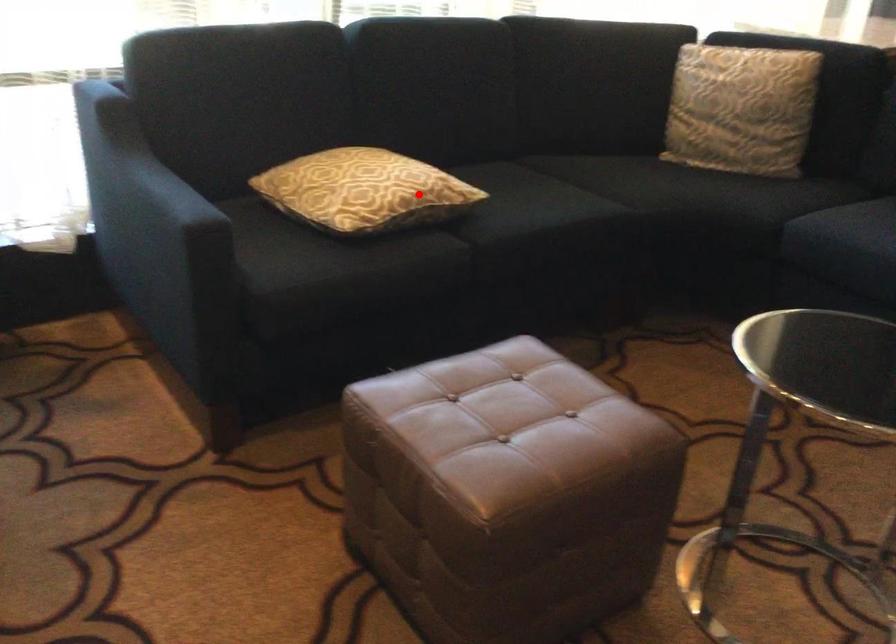
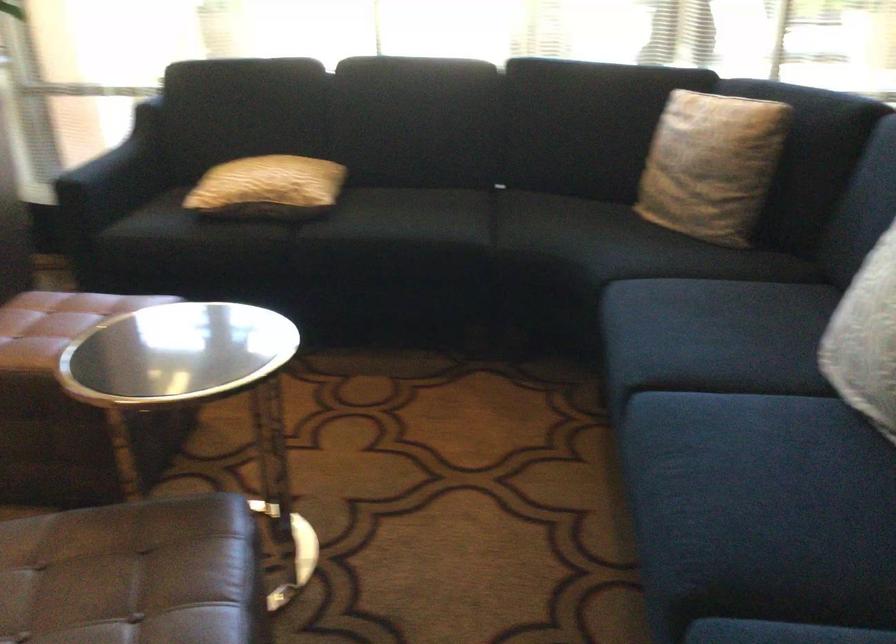
Question: I am providing you with two images of the same scene from different viewpoints. Given a red point in image1, look at the same physical point in image2. Is it:

Choices:
 (A) Closer to the viewpoint
 (B) Farther from the viewpoint

Answer: (B)